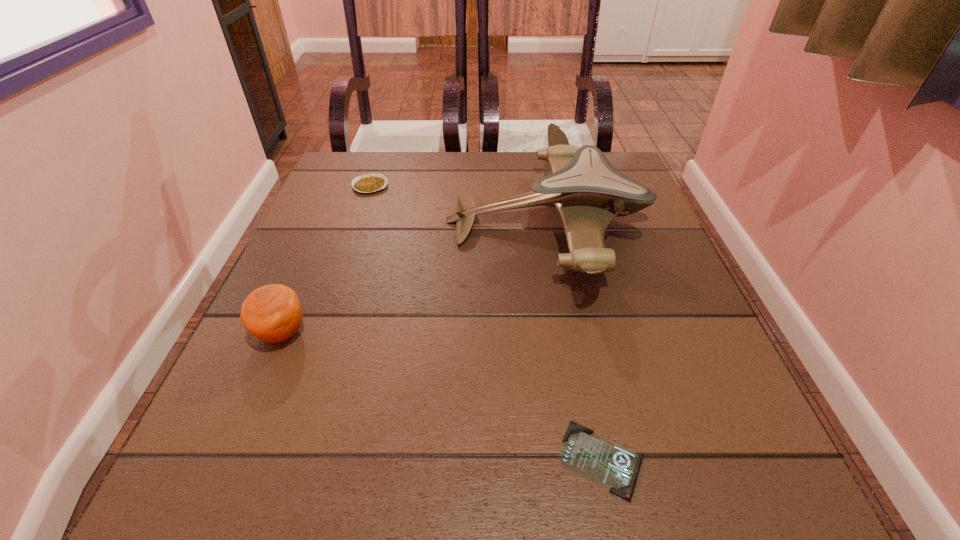
This screenshot has width=960, height=540. I want to click on vacant space located 0.380m on the back of the nearest object, so click(559, 251).

Find the location of a particular element. The height and width of the screenshot is (540, 960). drone that is at the far edge is located at coordinates (588, 192).

Find the location of a particular element. legume located in the far edge section of the desktop is located at coordinates (368, 183).

Where is `object at the near edge`? Image resolution: width=960 pixels, height=540 pixels. object at the near edge is located at coordinates (613, 466).

This screenshot has width=960, height=540. Identify the location of orange located at the left edge. (272, 313).

You are a GUI agent. You are given a task and a screenshot of the screen. Output one action in this format:
    pyautogui.click(x=<x>, y=<y>)
    Task: Click on the legume located in the left edge section of the desktop
    The height and width of the screenshot is (540, 960).
    Given the screenshot: What is the action you would take?
    pyautogui.click(x=368, y=183)

Where is `object positioned at the right edge`? The image size is (960, 540). object positioned at the right edge is located at coordinates (588, 192).

Identify the location of object that is at the far left corner. This screenshot has height=540, width=960. (368, 183).

Locate an element on the screen. object located in the far right corner section of the desktop is located at coordinates (588, 192).

The height and width of the screenshot is (540, 960). In the image, there is a desktop. What are the coordinates of `vacant space at the far edge` in the screenshot? It's located at (453, 163).